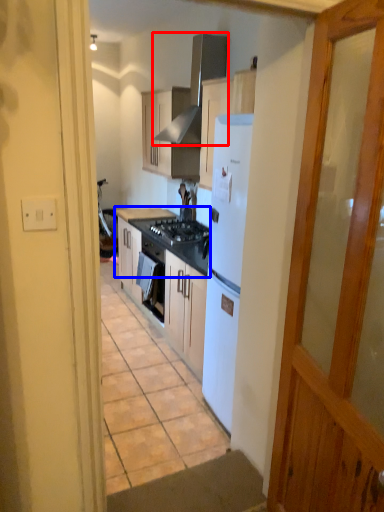
Question: Which object appears closest to the camera in this image, exhaust hood (highlighted by a red box) or countertop (highlighted by a blue box)?

Choices:
 (A) exhaust hood
 (B) countertop

Answer: (A)